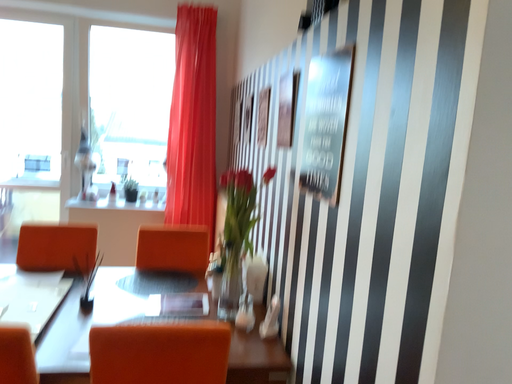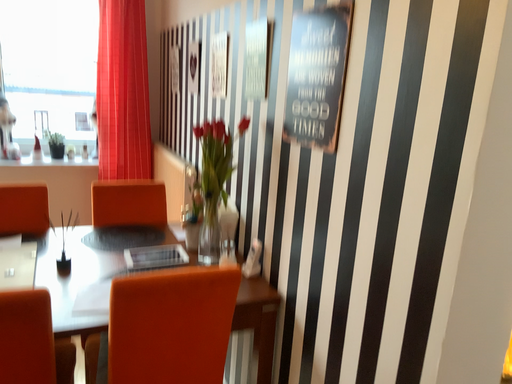
Question: How did the camera likely rotate when shooting the video?

Choices:
 (A) rotated upward
 (B) rotated downward

Answer: (B)